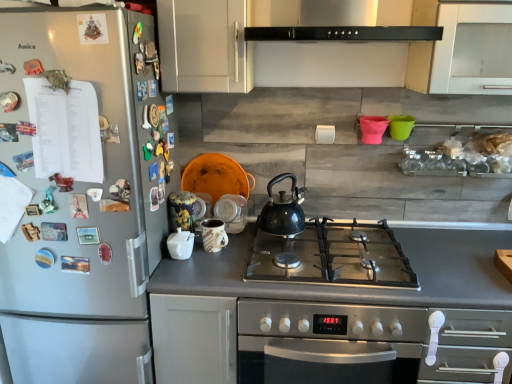
Find the location of `vacant space in front of white glossy sugar bowl at center, marked as the first appliance in a front-to-back arrangement`. vacant space in front of white glossy sugar bowl at center, marked as the first appliance in a front-to-back arrangement is located at coordinates (182, 278).